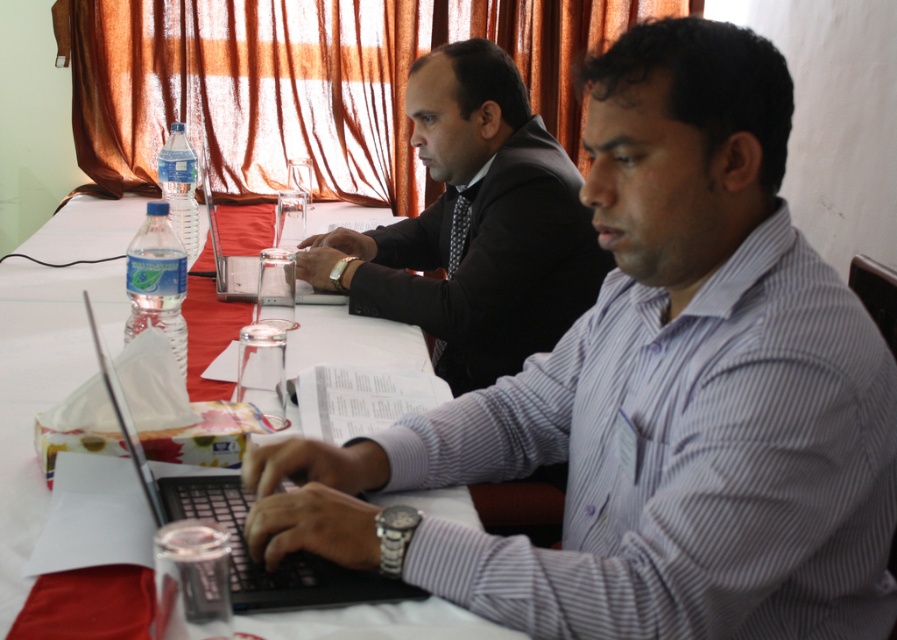
Is point (306, 243) positioned behind point (262, 248)?

No, (306, 243) is closer to viewer.

Find the location of `matte black suit at center`. matte black suit at center is located at coordinates 475,225.

The width and height of the screenshot is (897, 640). What are the coordinates of `matte black suit at center` in the screenshot? It's located at (475, 225).

Can you confirm if white paper at center is smaller than black plastic laptop at center?

Incorrect, white paper at center is not smaller in size than black plastic laptop at center.

Is point (118, 221) closer to camera compared to point (335, 573)?

No, it is behind (335, 573).

Measure the distance between point (248, 616) and camera.

Point (248, 616) and camera are 33.99 inches apart.

The width and height of the screenshot is (897, 640). I want to click on white paper at center, so click(41, 388).

Which is behind, point (318, 572) or point (218, 253)?

The point (218, 253) is more distant.

Can you confirm if black plastic laptop at center is bigger than clear plastic laptop at center?

Incorrect, black plastic laptop at center is not larger than clear plastic laptop at center.

Find the location of a particular element. This screenshot has width=897, height=640. black plastic laptop at center is located at coordinates [x=260, y=563].